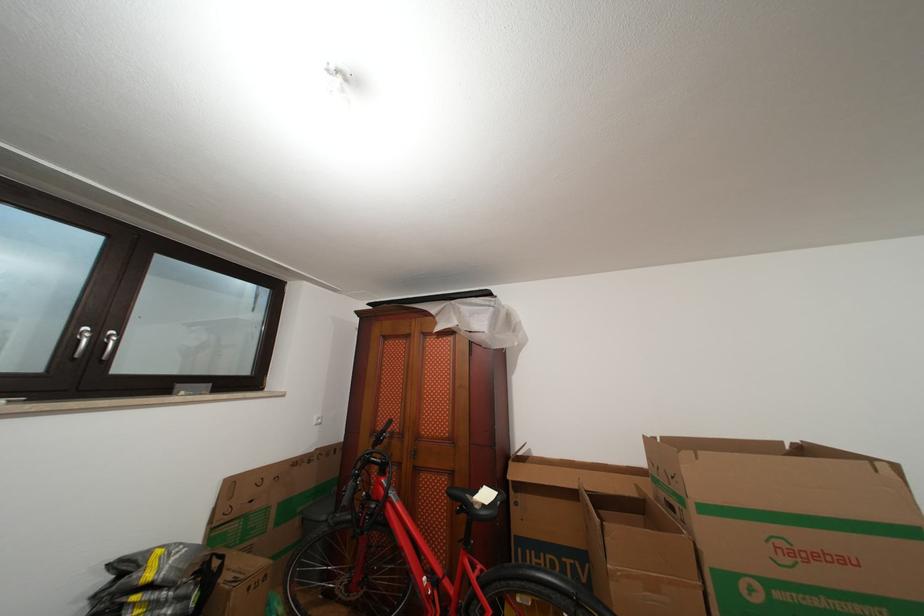
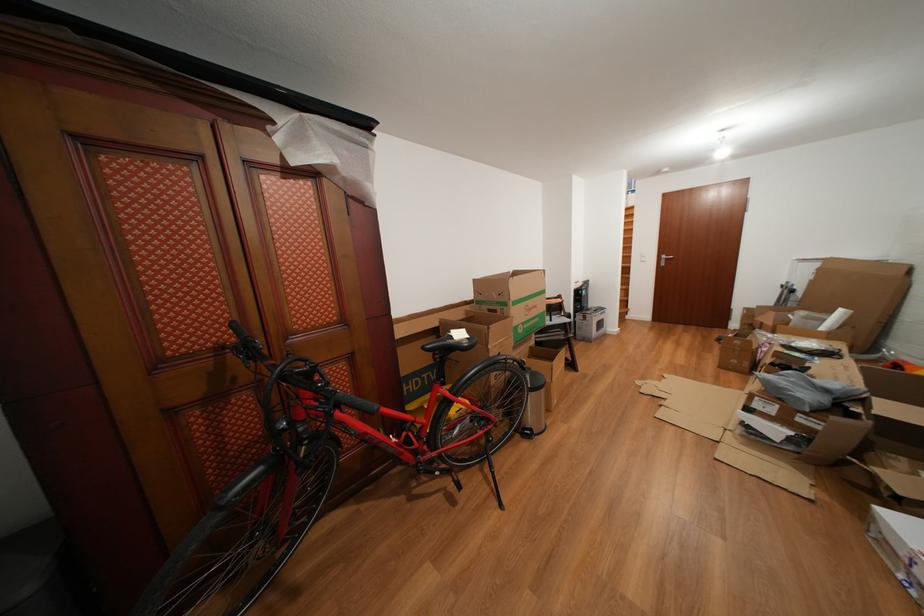
Where in the second image is the point corresponding to point (585, 492) from the first image?

(445, 330)